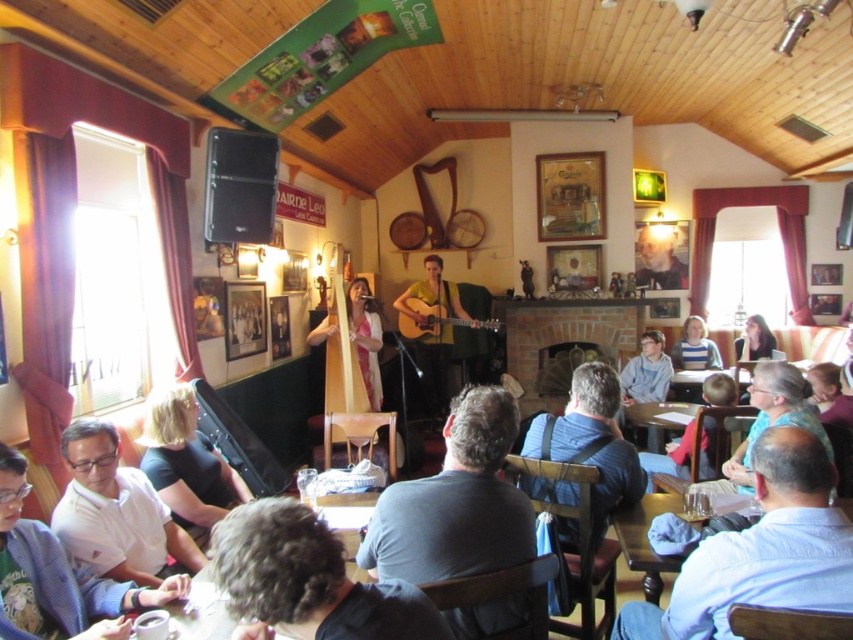
Question: Is gray cotton shirt at center wider than white cotton shirt at lower left?

Choices:
 (A) yes
 (B) no

Answer: (A)

Question: Can you confirm if black fabric shirt at lower left is positioned below matte white harp at center?

Choices:
 (A) no
 (B) yes

Answer: (B)

Question: Which is nearer to the white cotton shirt at lower left?

Choices:
 (A) matte black microphone at center
 (B) matte white harp at center

Answer: (B)

Question: Which point is farther to the camera?

Choices:
 (A) (757, 346)
 (B) (120, 595)
 (C) (200, 484)
 (D) (697, 340)

Answer: (A)

Question: Which point is closer to the camera?

Choices:
 (A) (163, 586)
 (B) (688, 349)

Answer: (A)

Question: Does gray cotton shirt at center appear under black fabric shirt at lower left?

Choices:
 (A) no
 (B) yes

Answer: (A)